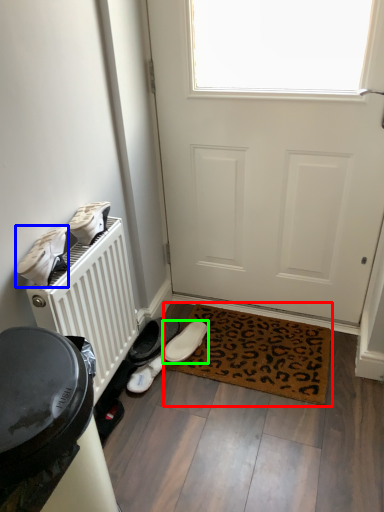
Question: Which object is the farthest from mat (highlighted by a red box)? Choose among these: footwear (highlighted by a blue box) or footwear (highlighted by a green box).

Choices:
 (A) footwear
 (B) footwear

Answer: (A)